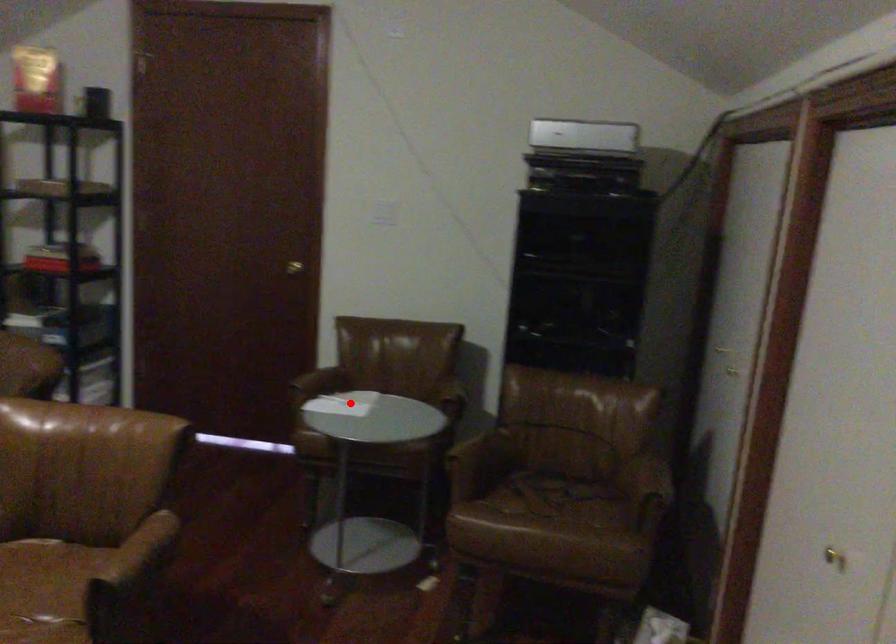
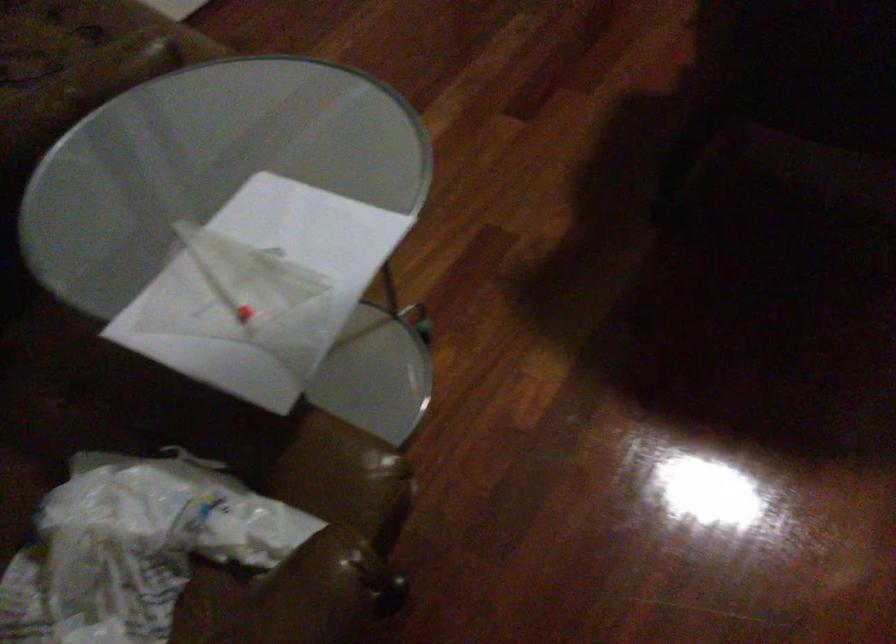
The point at the highlighted location is marked in the first image. Where is the corresponding point in the second image?

(134, 547)